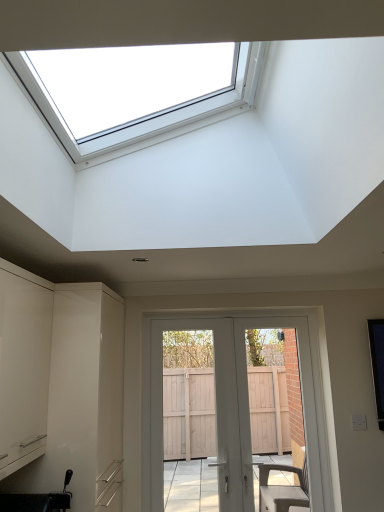
Question: From a real-world perspective, is white glossy cabinet at left, placed as the 1th cabinetry when sorted from back to front, physically located above or below black plastic sink at lower left?

Choices:
 (A) above
 (B) below

Answer: (A)

Question: In terms of height, does white glossy cabinet at left, the second cabinetry in the front-to-back sequence, look taller or shorter compared to black plastic sink at lower left?

Choices:
 (A) tall
 (B) short

Answer: (A)

Question: Based on their relative distances, which object is farther from the white glossy cabinet at left, the second cabinetry in the front-to-back sequence?

Choices:
 (A) black plastic sink at lower left
 (B) white glossy door at center
 (C) white matte cabinet at left, the second cabinetry viewed from the back

Answer: (B)

Question: Estimate the real-world distances between objects in this image. Which object is farther from the black plastic sink at lower left?

Choices:
 (A) white matte cabinet at left, the second cabinetry viewed from the back
 (B) white glossy door at center
 (C) white glossy cabinet at left, the second cabinetry in the front-to-back sequence

Answer: (B)